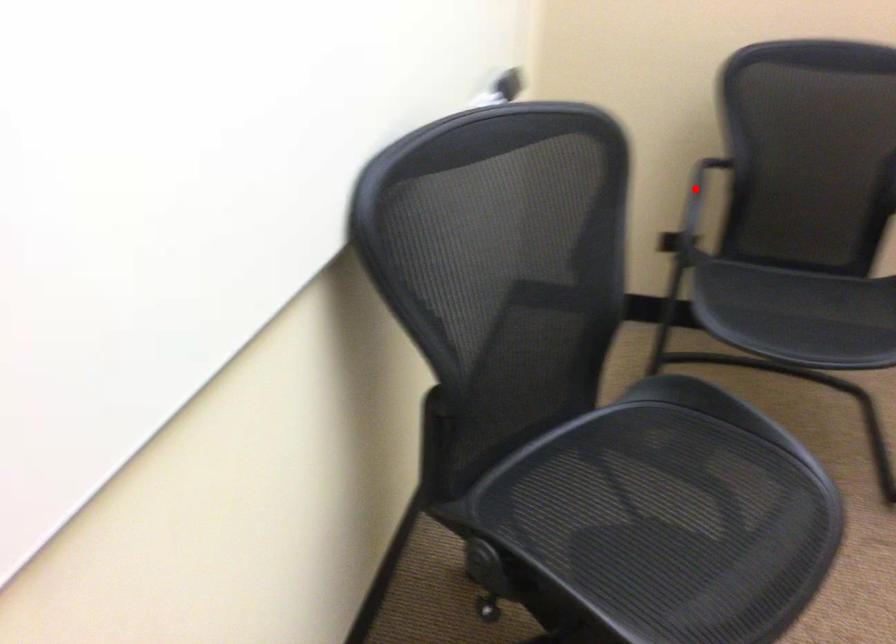
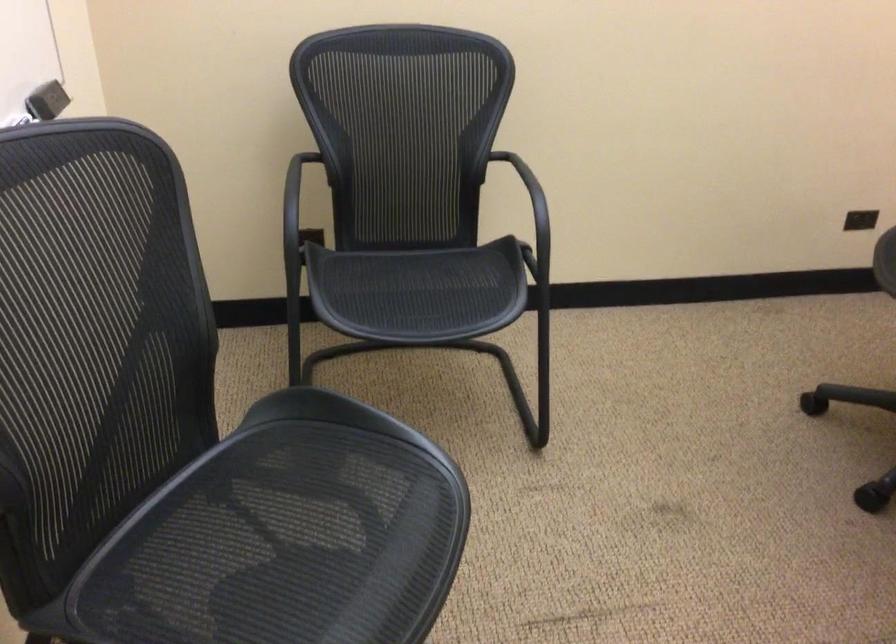
Where in the second image is the point corresponding to the highlighted location from the first image?

(298, 201)